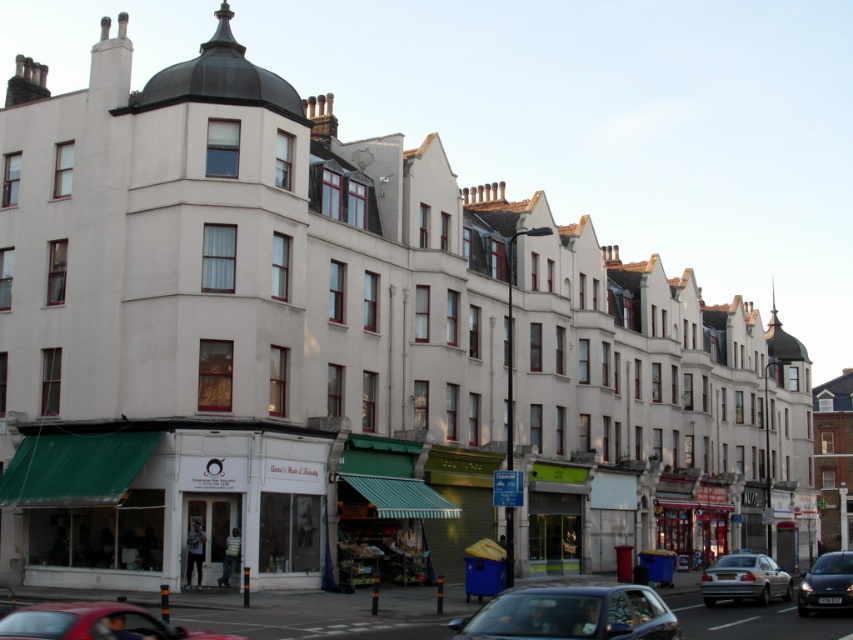
In the scene shown: You are a delivery person who needs to park your van between the shiny red car at lower left and the shiny black car at lower right. Your van is 6 meters long. Is there enough space between them to park your van?

The distance between the shiny red car at lower left and the shiny black car at lower right is 26.58 meters. Since your van is only 6 meters long, there is more than enough space to park between them.